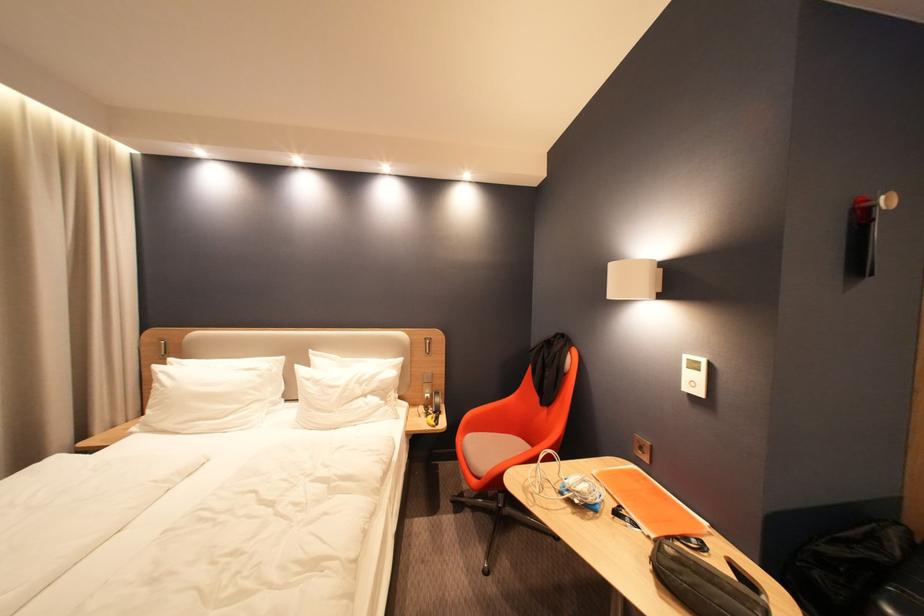
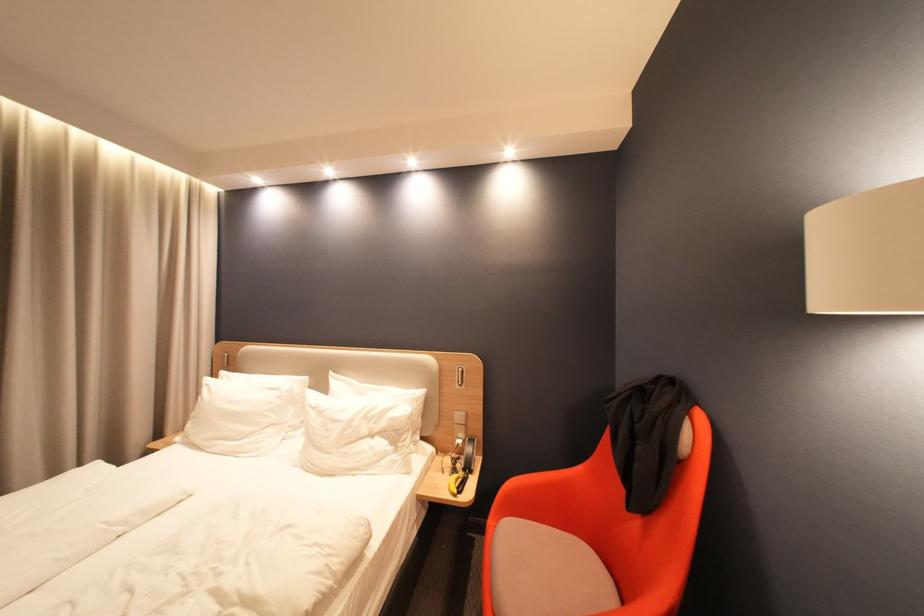
What movement of the cameraman would produce the second image?

The movement direction of the cameraman is right, forward.